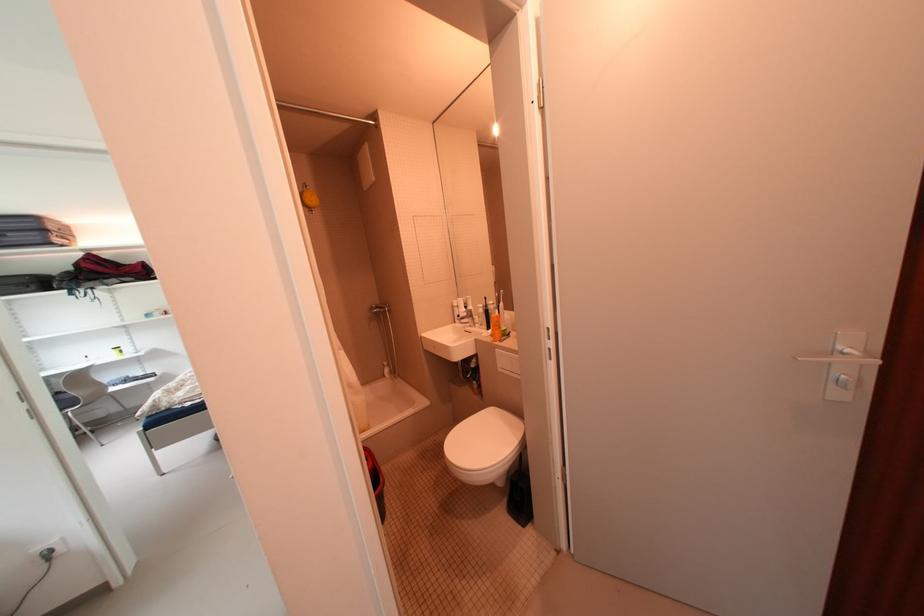
This screenshot has width=924, height=616. What do you see at coordinates (493, 322) in the screenshot?
I see `the orange pump bottle` at bounding box center [493, 322].